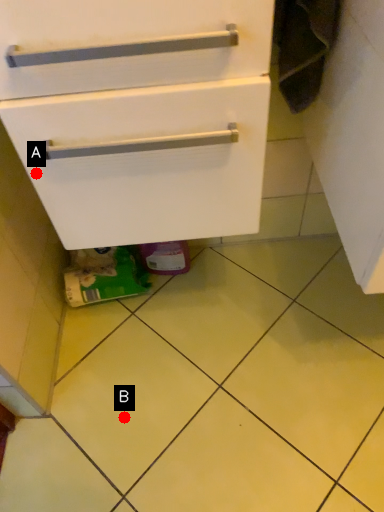
Question: Two points are circled on the image, labeled by A and B beside each circle. Which of the following is the farthest from the observer?

Choices:
 (A) A is further
 (B) B is further

Answer: (B)